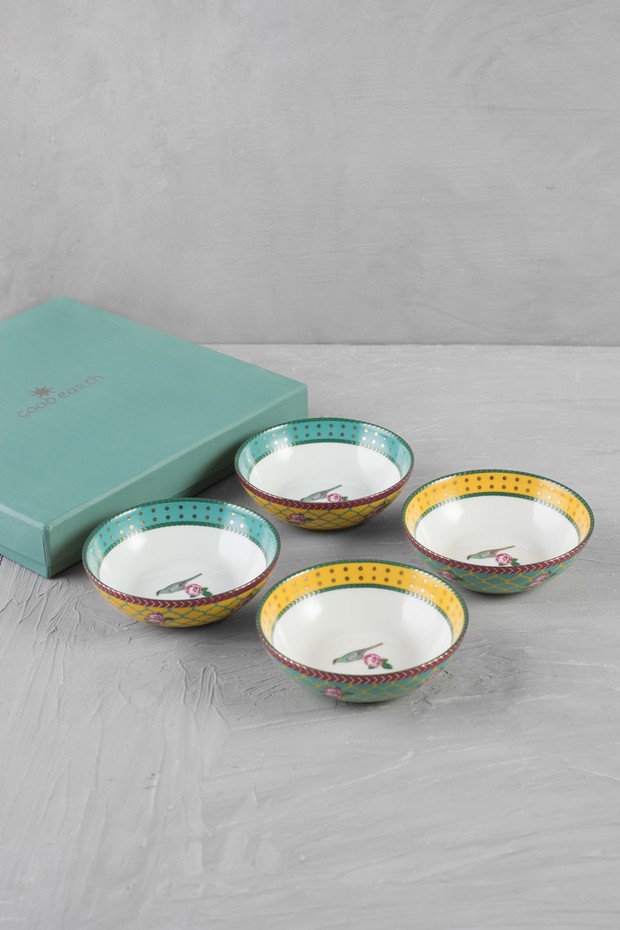
Locate an element on the screen. wall is located at coordinates (343, 129).